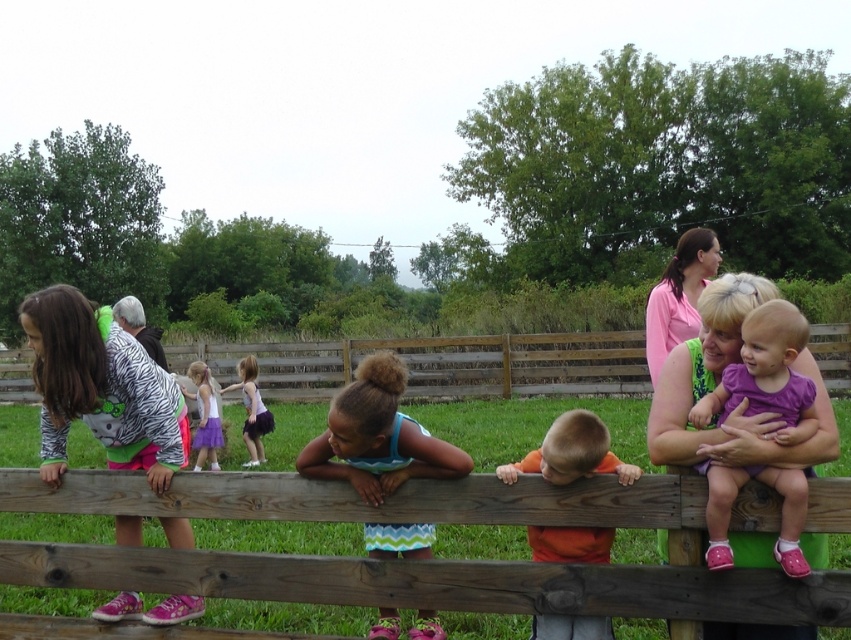
Question: Is purple fabric baby at center further to camera compared to light purple dress at center?

Choices:
 (A) yes
 (B) no

Answer: (B)

Question: Which object is the farthest from the pink matte shirt at upper center?

Choices:
 (A) zebra print shirt at left
 (B) wooden fence at center

Answer: (B)

Question: Is orange matte shirt at center in front of zebra print shirt at left?

Choices:
 (A) no
 (B) yes

Answer: (B)

Question: Among these points, which one is nearest to the camera?

Choices:
 (A) (0, 378)
 (B) (112, 316)

Answer: (B)

Question: In this image, where is chevron-patterned shorts at center located relative to light purple dress at center?

Choices:
 (A) above
 (B) below

Answer: (B)

Question: Which object appears farthest from the camera in this image?

Choices:
 (A) orange matte shirt at center
 (B) white cotton dress at center

Answer: (B)